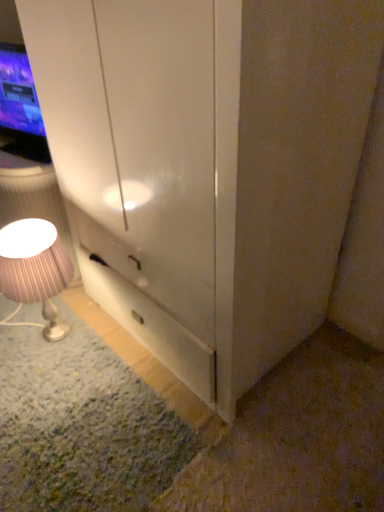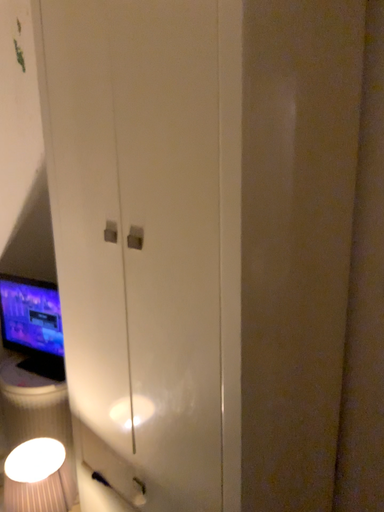
Question: How did the camera likely rotate when shooting the video?

Choices:
 (A) rotated upward
 (B) rotated downward

Answer: (A)